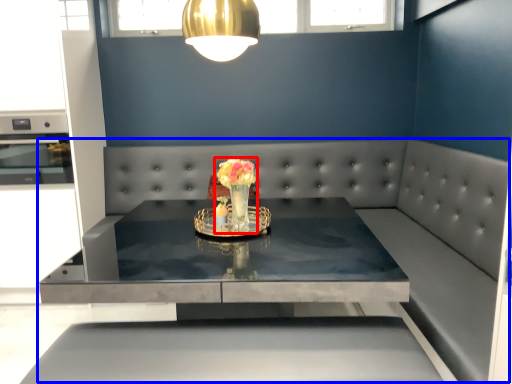
Question: Which of the following is the farthest to the observer, floral arrangement (highlighted by a red box) or couch (highlighted by a blue box)?

Choices:
 (A) floral arrangement
 (B) couch

Answer: (A)